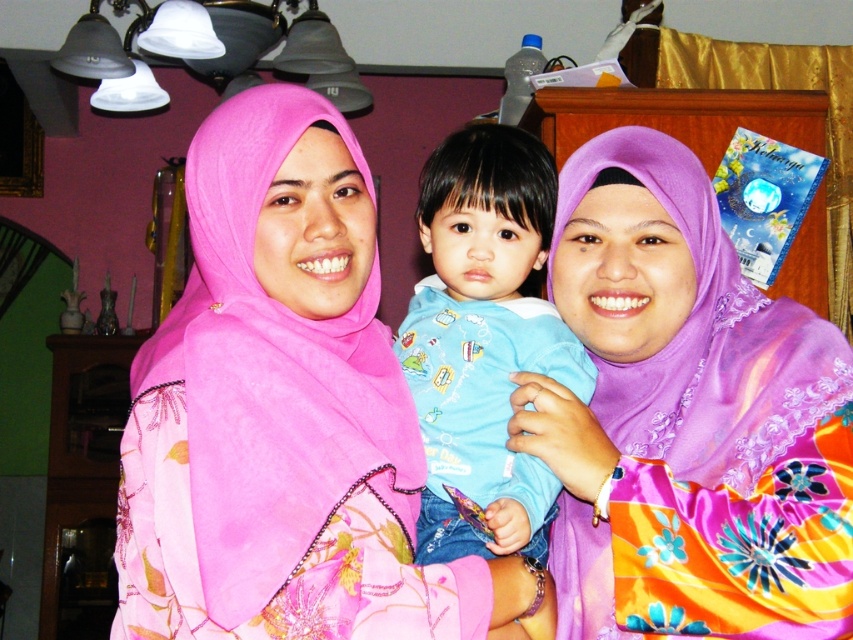
Is purple satin hijab at center taller than blue cotton shirt at center?

Indeed, purple satin hijab at center has a greater height compared to blue cotton shirt at center.

Which is behind, point (625, 227) or point (432, 516)?

Point (625, 227)

Locate an element on the screen. Image resolution: width=853 pixels, height=640 pixels. purple satin hijab at center is located at coordinates (686, 419).

Consider the image. Who is higher up, pink satin hijab at center or blue cotton shirt at center?

Positioned higher is blue cotton shirt at center.

Does pink satin hijab at center come behind blue cotton shirt at center?

No, pink satin hijab at center is in front of blue cotton shirt at center.

Where is `pink satin hijab at center`? The image size is (853, 640). pink satin hijab at center is located at coordinates (283, 412).

Is point (184, 317) in front of point (776, 378)?

Yes, point (184, 317) is in front of point (776, 378).

From the picture: Is the position of pink satin hijab at center more distant than that of purple satin hijab at center?

That is False.

Which is behind, point (132, 472) or point (793, 588)?

Point (132, 472)

Identify the location of pink satin hijab at center. (283, 412).